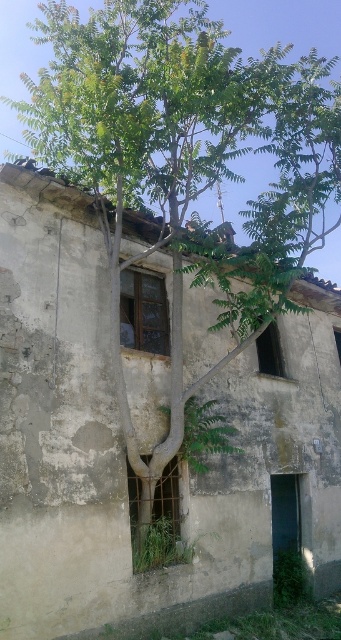
Question: In this image, where is metallic wire mesh at center located relative to wooden-framed window at center-left?

Choices:
 (A) above
 (B) below

Answer: (B)

Question: Can you confirm if metallic wire mesh at center is bigger than dark glass window at center?

Choices:
 (A) no
 (B) yes

Answer: (B)

Question: Considering the real-world distances, which object is farthest from the dark glass window at center?

Choices:
 (A) wooden-framed window at center-left
 (B) metallic wire mesh at center

Answer: (B)

Question: Which of the following is the closest to the observer?

Choices:
 (A) dark glass window at center
 (B) wooden-framed window at center-left
 (C) metallic wire mesh at center

Answer: (C)

Question: Can you confirm if metallic wire mesh at center is wider than wooden-framed window at center-left?

Choices:
 (A) no
 (B) yes

Answer: (B)

Question: Which object is the closest to the metallic wire mesh at center?

Choices:
 (A) dark glass window at center
 (B) wooden-framed window at center-left

Answer: (B)